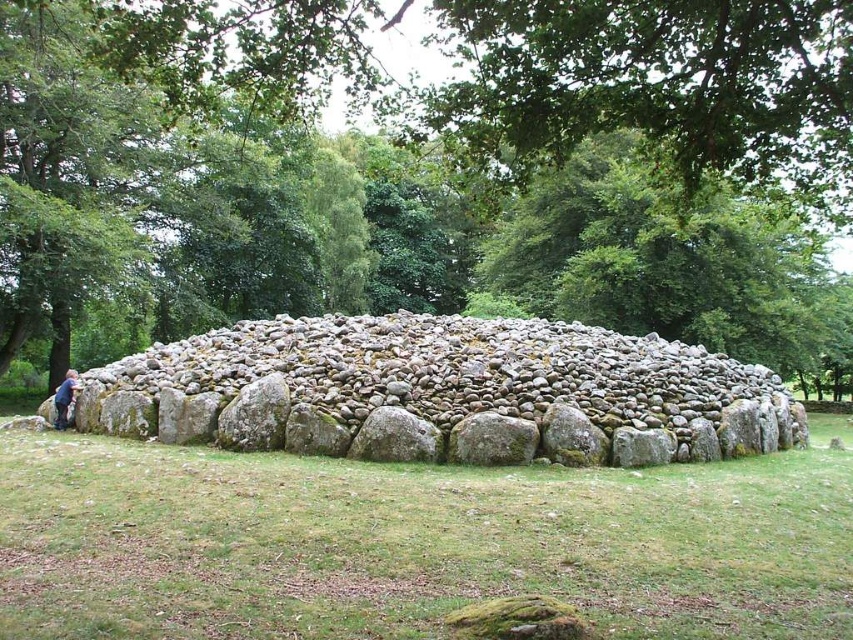
You are standing in front of the large stone structure and notice a green leafy tree at center and a smooth gray rock at center. Which object is located to the right of the other?

The green leafy tree at center is positioned on the right side of smooth gray rock at center, so the green leafy tree at center is to the right of the smooth gray rock at center.

You are a hiker who wants to place a 10 meter long tent between the green leafy tree at center and the smooth gray rock at center. Can you fit the tent between them without overlapping either object?

The distance between the green leafy tree at center and the smooth gray rock at center is 13.58 meters. Since the tent is 10 meters long, there is enough space to place it between them without overlapping either object.

You are standing in front of the ancient stone structure and notice a green leafy tree at center and a smooth gray rock at center. Which object is nearer to you?

The green leafy tree at center is closer to the viewer than the smooth gray rock at center, so the green leafy tree at center is nearer to you.